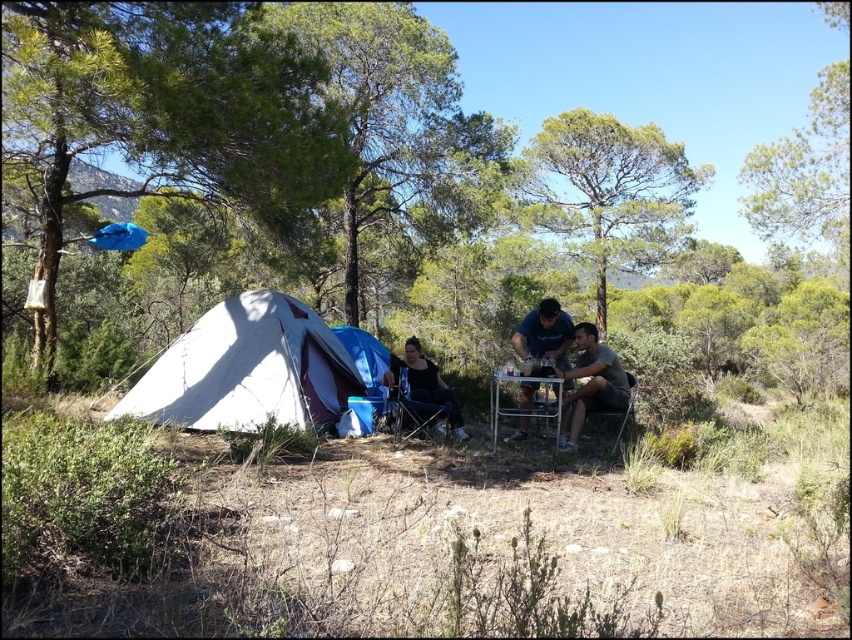
You are setting up a campsite and need to place a small lantern between the green fabric chair at center and the metallic silver chair at center. Based on their positions, which chair should the lantern be closer to?

The green fabric chair at center is positioned on the left side of metallic silver chair at center, so the lantern should be placed closer to the green fabric chair at center to maintain symmetry between the two chairs.

You are a camper trying to choose between two chairs to sit on. The green fabric chair at center and the metallic silver chair at center are available. Which chair is taller?

The green fabric chair at center is taller than the metallic silver chair at center.

You are a camper who wants to set up a tent but needs to move the metallic silver table at center and the green leafy tree at center. Which object should you move first if you want to access the tent area more easily?

The metallic silver table at center is behind the green leafy tree at center, so you should move the green leafy tree at center first to access the tent area more easily.